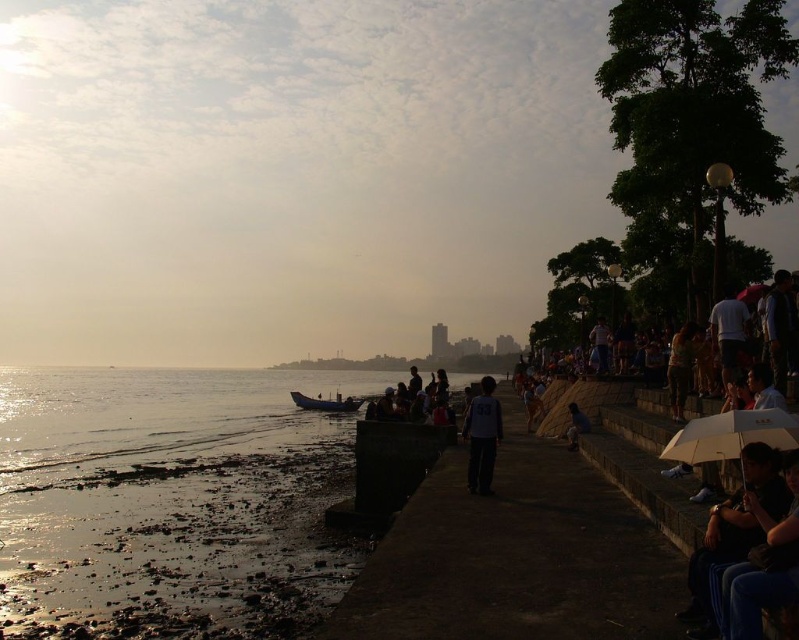
Can you confirm if blue denim jeans at lower right is bigger than wooden boat at lower center?

Actually, blue denim jeans at lower right might be smaller than wooden boat at lower center.

Is blue denim jeans at lower right smaller than wooden boat at lower center?

Correct, blue denim jeans at lower right occupies less space than wooden boat at lower center.

Describe the element at coordinates (762, 566) in the screenshot. I see `blue denim jeans at lower right` at that location.

At what (x,y) coordinates should I click in order to perform the action: click on blue denim jeans at lower right. Please return your answer as a coordinate pair (x, y). The width and height of the screenshot is (799, 640). Looking at the image, I should click on coord(762,566).

Between white matte shirt at center and dark blue jeans at lower center, which one is positioned higher?

white matte shirt at center is above.

Image resolution: width=799 pixels, height=640 pixels. What do you see at coordinates (483, 436) in the screenshot?
I see `white matte shirt at center` at bounding box center [483, 436].

Identify the location of white matte shirt at center. (483, 436).

The image size is (799, 640). What are the coordinates of `white matte umbrella at lower right` in the screenshot? It's located at (730, 435).

Which of these two, white matte umbrella at lower right or dark blue jeans at lower center, stands shorter?

white matte umbrella at lower right is shorter.

Which is behind, point (730, 419) or point (583, 429)?

The point (583, 429) is more distant.

You are a GUI agent. You are given a task and a screenshot of the screen. Output one action in this format:
    pyautogui.click(x=<x>, y=<y>)
    Task: Click on the white matte umbrella at lower right
    Image resolution: width=799 pixels, height=640 pixels.
    Given the screenshot: What is the action you would take?
    pyautogui.click(x=730, y=435)